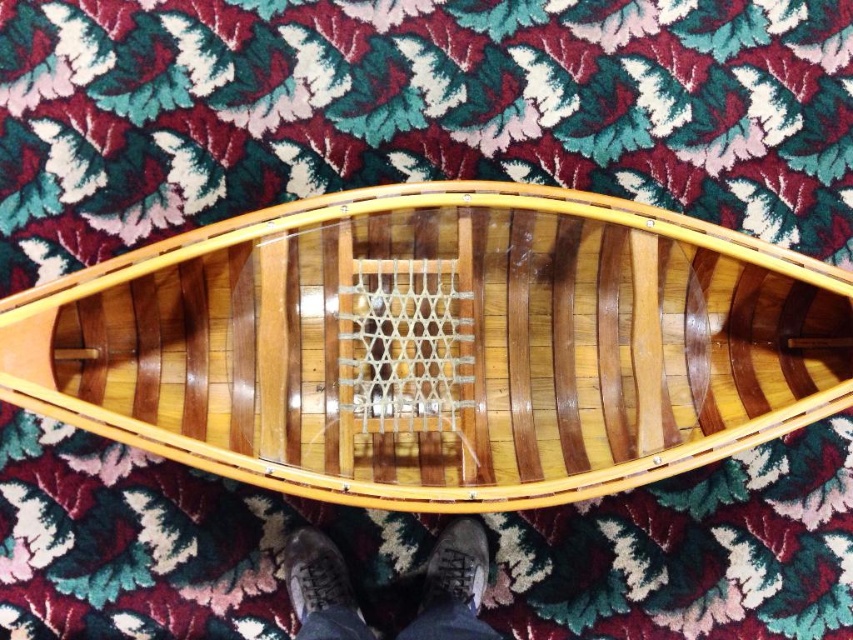
You are standing in the room where the wooden canoe is placed on the patterned carpet. You see two points marked on the floor. The first point is at coordinate point (x=631, y=344) and the second point is at coordinate point (x=305, y=563). If you were to walk from the first point to the second point, would you be moving forward or backward relative to your current position?

Since point (x=631, y=344) is in front of point (x=305, y=563), moving from the first point to the second point would mean moving backward relative to your current position.

You are standing at the point marked as point (337, 241) in the image. The canoe is 1.32 meters away from you. Can you reach the canoe from your current position without moving your feet?

The distance between you and the canoe is 1.32 meters. Since the average human arm span is about 1.3 meters, it might be slightly challenging but possible to reach the canoe if you stretch your arms fully. However, this depends on individual arm length and flexibility.